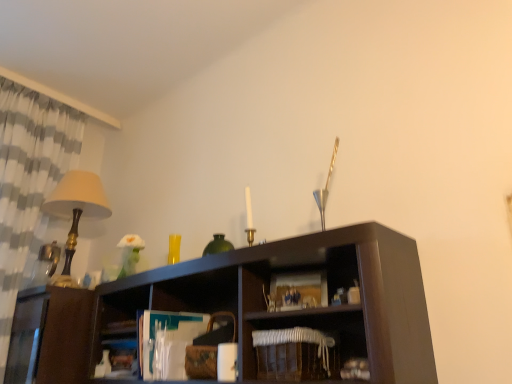
Question: Considering the relative sizes of white woven basket at lower center and matte gold table lamp at left in the image provided, is white woven basket at lower center bigger than matte gold table lamp at left?

Choices:
 (A) yes
 (B) no

Answer: (B)

Question: Is white woven basket at lower center aimed at matte gold table lamp at left?

Choices:
 (A) no
 (B) yes

Answer: (A)

Question: Is white woven basket at lower center behind matte gold table lamp at left?

Choices:
 (A) no
 (B) yes

Answer: (A)

Question: From the image's perspective, is white woven basket at lower center above matte gold table lamp at left?

Choices:
 (A) yes
 (B) no

Answer: (B)

Question: Is matte gold table lamp at left surrounded by white woven basket at lower center?

Choices:
 (A) no
 (B) yes

Answer: (A)

Question: From the image's perspective, is white checkered fabric at left located above or below white woven basket at lower center?

Choices:
 (A) below
 (B) above

Answer: (B)

Question: Is white checkered fabric at left inside or outside of white woven basket at lower center?

Choices:
 (A) inside
 (B) outside

Answer: (B)

Question: From their relative heights in the image, would you say white checkered fabric at left is taller or shorter than white woven basket at lower center?

Choices:
 (A) tall
 (B) short

Answer: (A)

Question: Does point (31, 182) appear closer or farther from the camera than point (247, 357)?

Choices:
 (A) farther
 (B) closer

Answer: (A)

Question: Considering the positions of matte gold table lamp at left and white woven basket at lower center in the image, is matte gold table lamp at left wider or thinner than white woven basket at lower center?

Choices:
 (A) thin
 (B) wide

Answer: (B)

Question: In the image, is matte gold table lamp at left positioned in front of or behind white woven basket at lower center?

Choices:
 (A) behind
 (B) front

Answer: (A)

Question: From a real-world perspective, is matte gold table lamp at left physically located above or below white woven basket at lower center?

Choices:
 (A) below
 (B) above

Answer: (B)

Question: Is point click(95, 198) positioned closer to the camera than point click(343, 307)?

Choices:
 (A) farther
 (B) closer

Answer: (A)

Question: Based on their sizes in the image, would you say white checkered fabric at left is bigger or smaller than matte gold table lamp at left?

Choices:
 (A) small
 (B) big

Answer: (B)

Question: From a real-world perspective, is white checkered fabric at left above or below matte gold table lamp at left?

Choices:
 (A) above
 (B) below

Answer: (A)